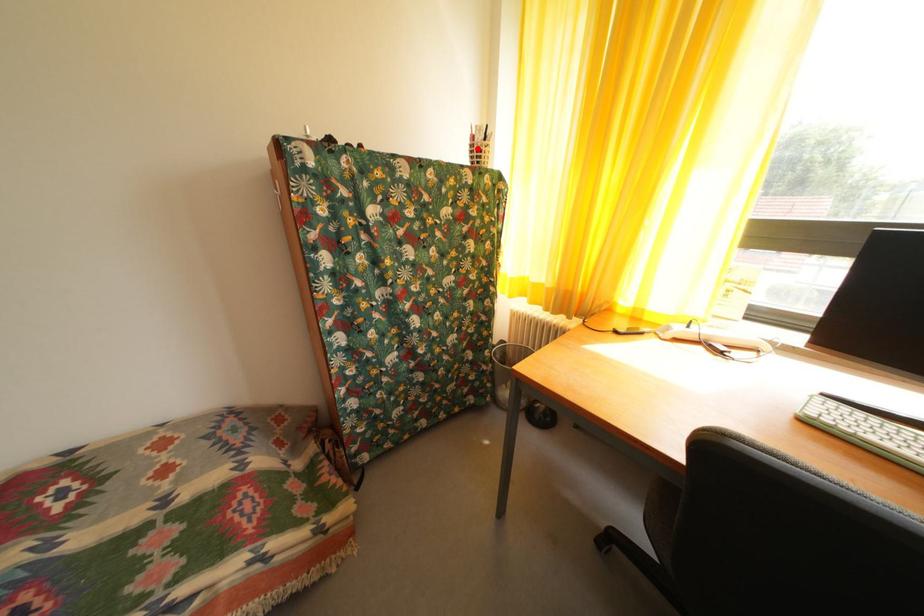
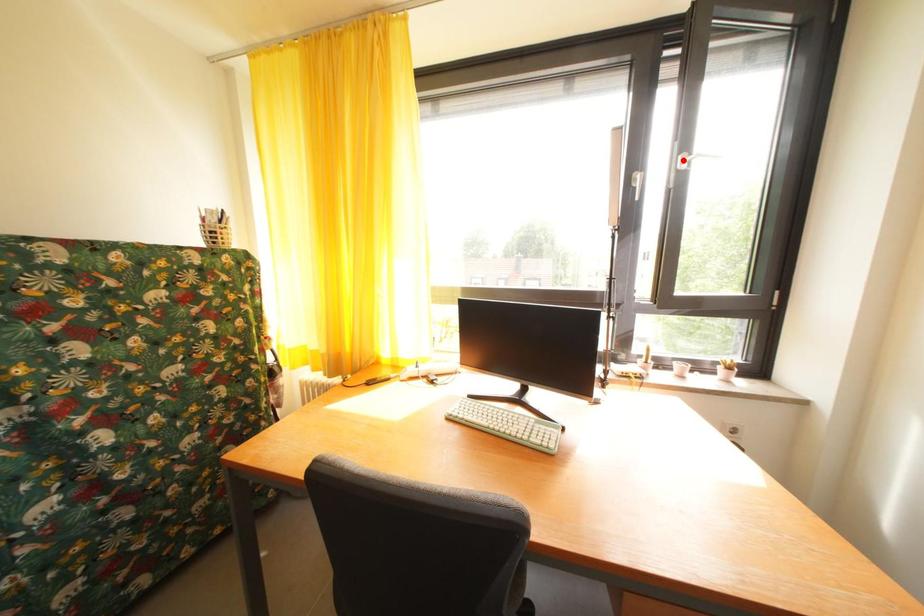
I am providing you with two images of the same scene from different viewpoints. A red point is marked on the first image and another point is marked on the second image. Are the points marked in image1 and image2 representing the same 3D position?

No